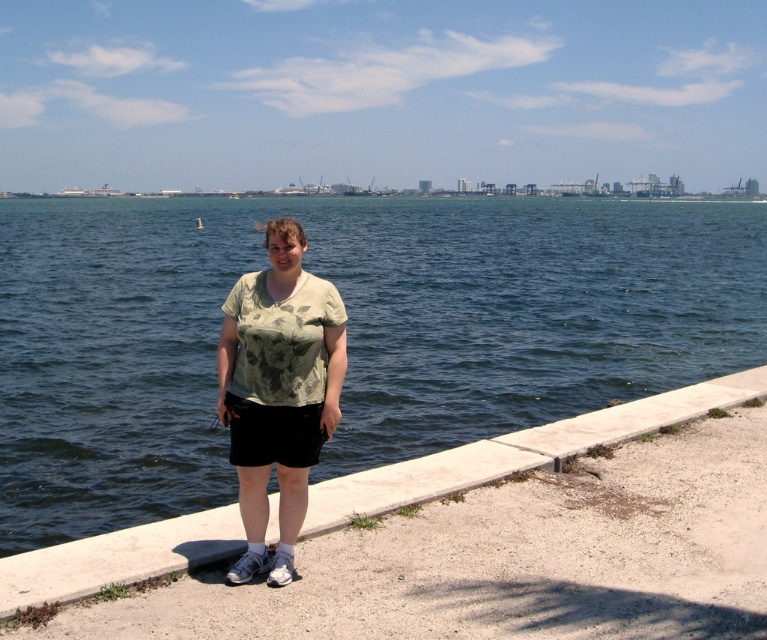
Question: Is concrete at center below green floral shirt at center?

Choices:
 (A) no
 (B) yes

Answer: (B)

Question: Is dark blue water at center behind concrete at center?

Choices:
 (A) no
 (B) yes

Answer: (A)

Question: Among these objects, which one is farthest from the camera?

Choices:
 (A) dark blue water at center
 (B) green floral shirt at center

Answer: (A)

Question: Considering the real-world distances, which object is closest to the concrete at center?

Choices:
 (A) dark blue water at center
 (B) green floral shirt at center

Answer: (B)

Question: Which object appears farthest from the camera in this image?

Choices:
 (A) concrete at center
 (B) dark blue water at center
 (C) green floral shirt at center

Answer: (A)

Question: Does dark blue water at center have a lesser width compared to green floral shirt at center?

Choices:
 (A) no
 (B) yes

Answer: (A)